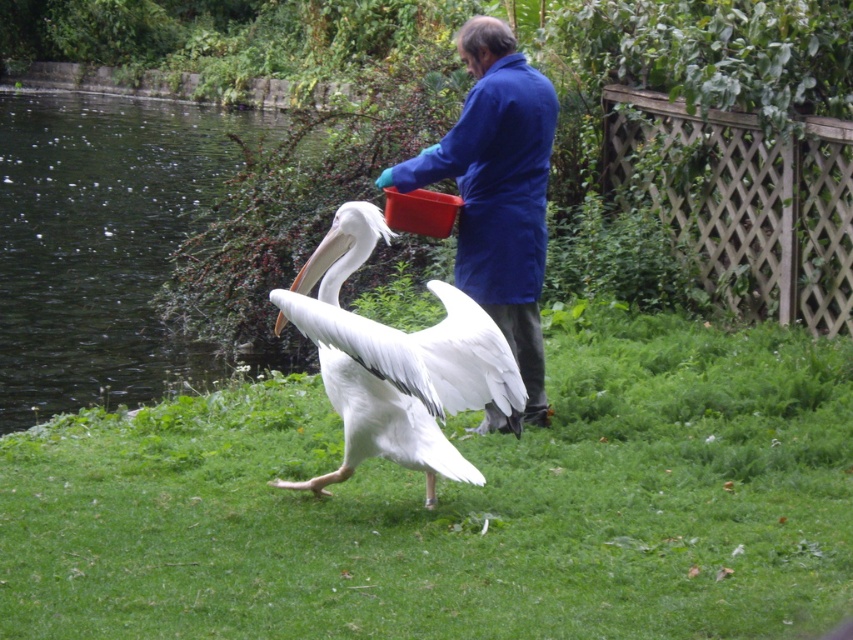
You are a photographer trying to capture a closeup of the white matte pelican at center while also ensuring the blue fabric coat at center is visible in the frame. Given their size difference, which object should you focus on first to ensure both are in focus?

The white matte pelican at center is larger than the blue fabric coat at center, so focusing on the pelican first will help ensure both are in focus as it takes up more space in the frame.

You are a photographer standing at the edge of the grass. You want to take a photo of the white matte pelican at center without including the green grass at center in the frame. Is the distance between them sufficient to allow you to zoom in on the pelican while excluding the grass?

The green grass at center is 33.02 inches from the white matte pelican at center. Since the grass is close to the pelican, zooming in might still include some of the grass in the frame unless the photographer adjusts their position or uses a longer focal length to compress the perspective and isolate the pelican.